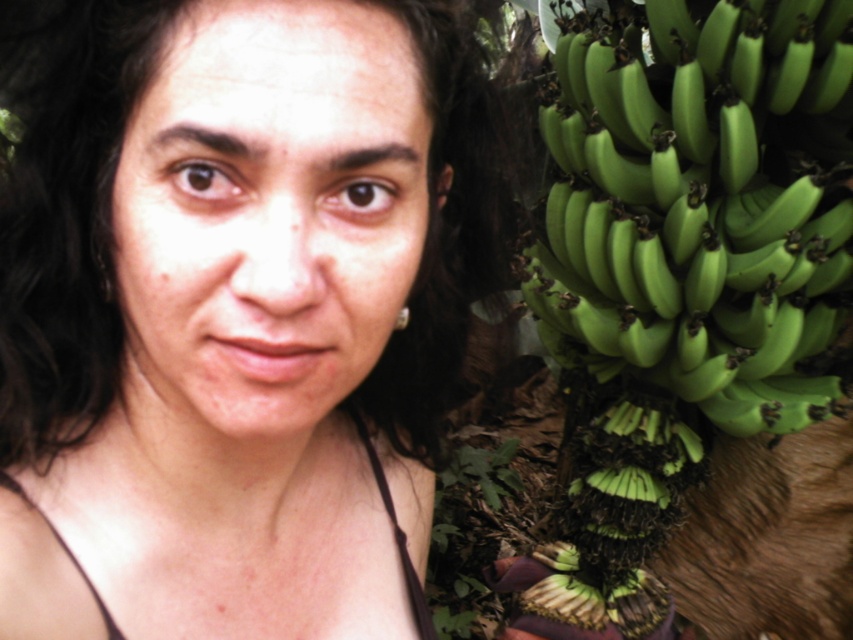
Question: Which point appears farthest from the camera in this image?

Choices:
 (A) (618, 278)
 (B) (347, 264)

Answer: (A)

Question: Does matte skin at center appear on the left side of green matte bananas at right?

Choices:
 (A) yes
 (B) no

Answer: (A)

Question: Does matte skin at center have a larger size compared to green matte bananas at right?

Choices:
 (A) yes
 (B) no

Answer: (B)

Question: Among these objects, which one is nearest to the camera?

Choices:
 (A) matte skin at center
 (B) green matte bananas at right

Answer: (A)

Question: Can you confirm if matte skin at center is thinner than green matte bananas at right?

Choices:
 (A) no
 (B) yes

Answer: (B)